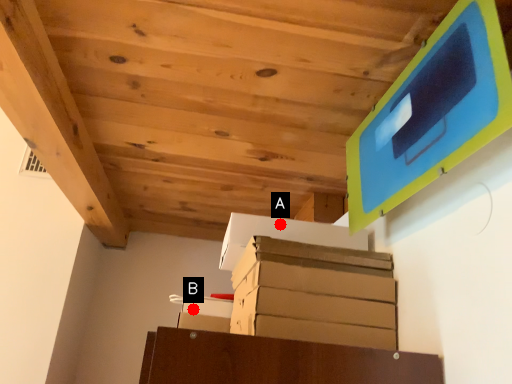
Question: Two points are circled on the image, labeled by A and B beside each circle. Which of the following is the farthest from the observer?

Choices:
 (A) A is further
 (B) B is further

Answer: (B)